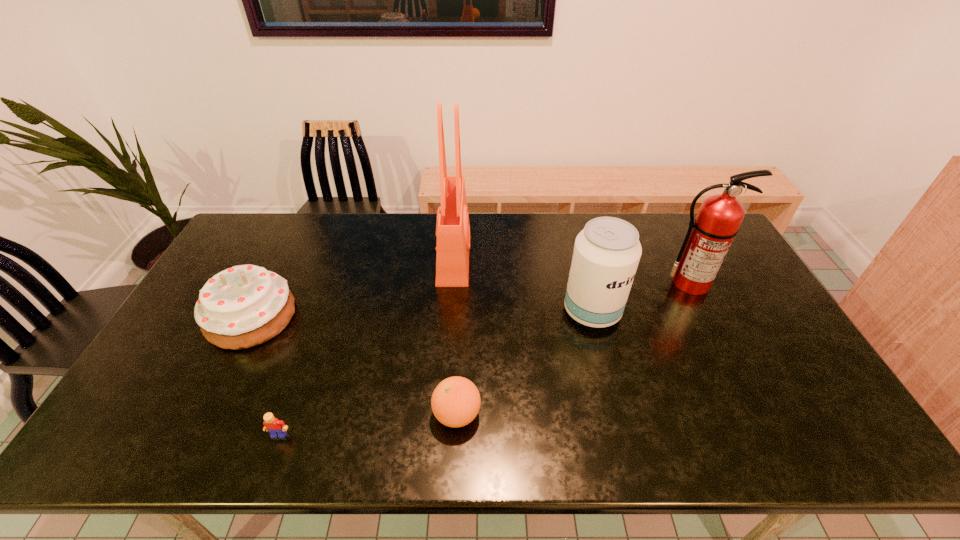
You are a GUI agent. You are given a task and a screenshot of the screen. Output one action in this format:
    pyautogui.click(x=<x>, y=<y>)
    Task: Click on the tallest object
    The height and width of the screenshot is (540, 960).
    Given the screenshot: What is the action you would take?
    pyautogui.click(x=452, y=226)

This screenshot has height=540, width=960. I want to click on the fifth shortest object, so click(709, 236).

Locate an element on the screen. fire extinguisher is located at coordinates (709, 236).

Where is `alcohol`? The width and height of the screenshot is (960, 540). alcohol is located at coordinates (606, 254).

This screenshot has height=540, width=960. Identify the location of the fifth object from left to right. (x=606, y=254).

Where is `cake`? cake is located at coordinates (243, 306).

Where is `the third shortest object`? The image size is (960, 540). the third shortest object is located at coordinates (243, 306).

At what (x,y) coordinates should I click in order to perform the action: click on the second shortest object. Please return your answer as a coordinate pair (x, y). This screenshot has width=960, height=540. Looking at the image, I should click on (455, 402).

Identify the location of the shortest object. (277, 428).

The image size is (960, 540). What are the coordinates of `the fifth object from right to left` in the screenshot? It's located at pos(277,428).